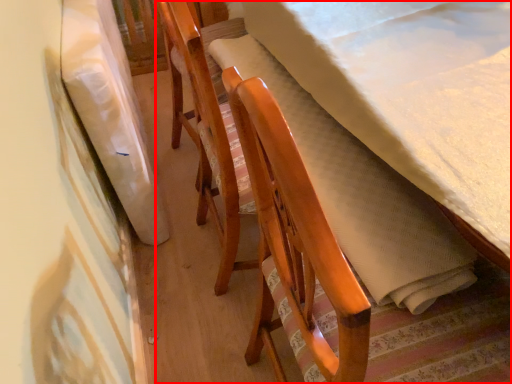
Question: In this image, where is furniture (annotated by the red box) located relative to blanket?

Choices:
 (A) left
 (B) right

Answer: (B)